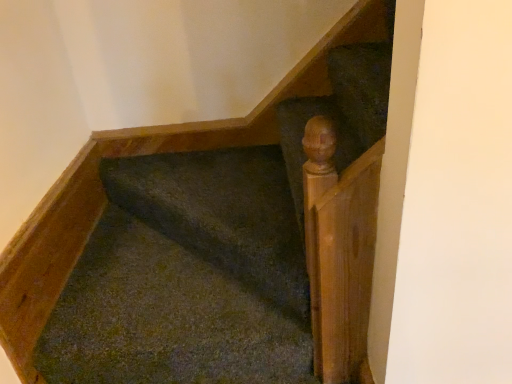
Find the location of a particular element. This screenshot has height=384, width=512. carpeted stairs at center is located at coordinates (209, 253).

The image size is (512, 384). What do you see at coordinates (209, 253) in the screenshot? I see `carpeted stairs at center` at bounding box center [209, 253].

Where is `carpeted stairs at center`? carpeted stairs at center is located at coordinates (209, 253).